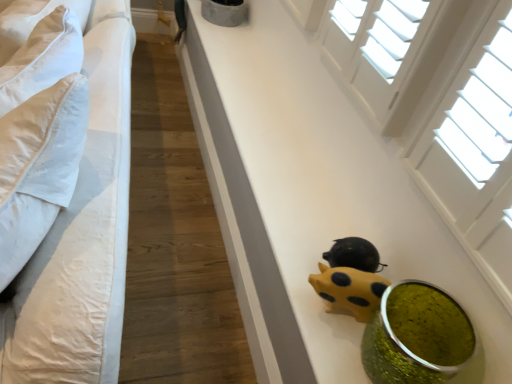
You are a GUI agent. You are given a task and a screenshot of the screen. Output one action in this format:
    pyautogui.click(x=<x>, y=<y>)
    Task: Click on the free space to the left of yellow matte piggy bank at lower center
    
    Given the screenshot: What is the action you would take?
    pyautogui.click(x=295, y=278)